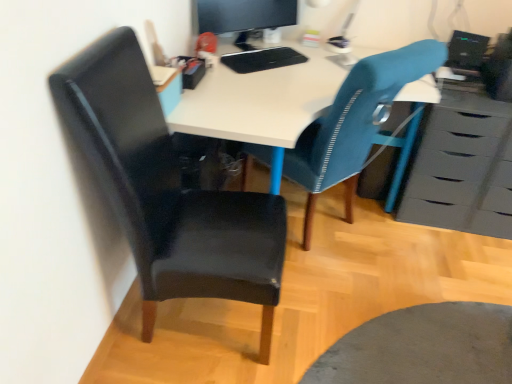
Question: Considering the relative positions of textured blue chair at center, the 2th chair positioned from the left, and matte gray chest of drawers at right in the image provided, is textured blue chair at center, the 2th chair positioned from the left, to the left or to the right of matte gray chest of drawers at right?

Choices:
 (A) left
 (B) right

Answer: (A)

Question: Looking at their shapes, would you say textured blue chair at center, arranged as the 1th chair when viewed from the right, is wider or thinner than matte gray chest of drawers at right?

Choices:
 (A) wide
 (B) thin

Answer: (A)

Question: Which is nearer to the black glossy computer at upper right?

Choices:
 (A) matte gray chest of drawers at right
 (B) matte black monitor at upper center
 (C) black leather chair at left, the second chair in the right-to-left sequence
 (D) textured blue chair at center, arranged as the 1th chair when viewed from the right

Answer: (A)

Question: Estimate the real-world distances between objects in this image. Which object is farther from the matte gray chest of drawers at right?

Choices:
 (A) black glossy computer at upper right
 (B) textured blue chair at center, arranged as the 1th chair when viewed from the right
 (C) matte black monitor at upper center
 (D) black leather chair at left, acting as the 1th chair starting from the left

Answer: (C)